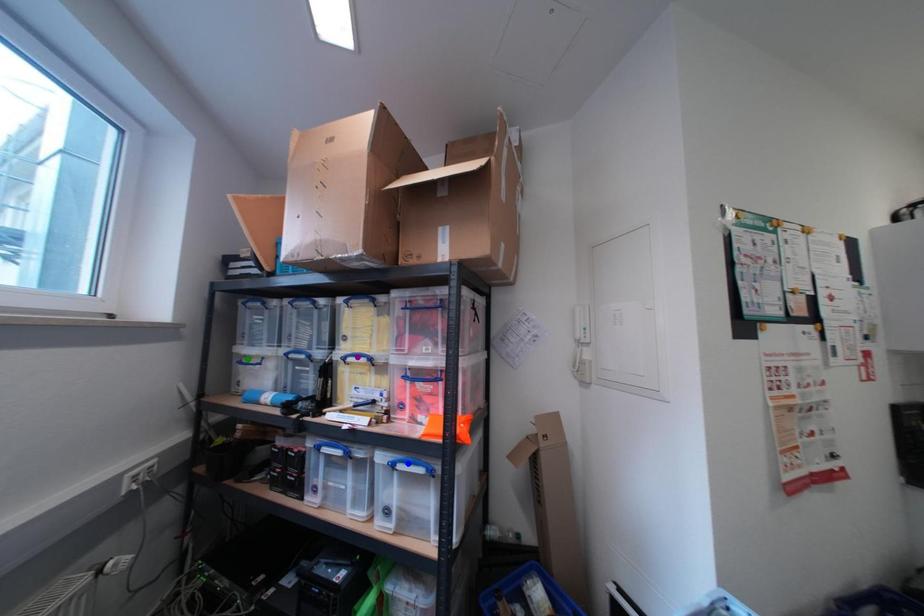
Order these from farthest to nearest:
purple point, blue point, green point

1. green point
2. purple point
3. blue point